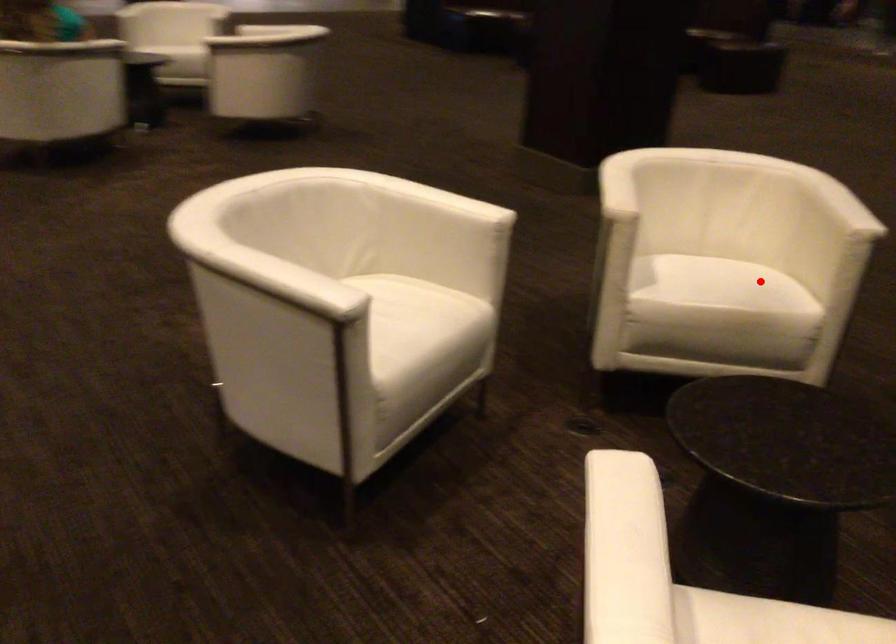
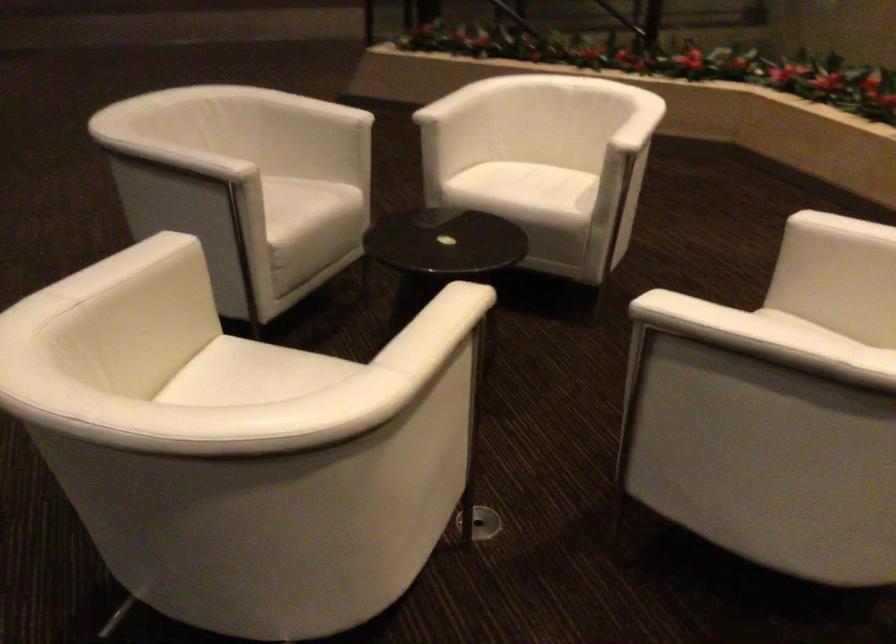
Question: A red point is marked in image1. In image2, is the corresponding 3D point closer to the camera or farther? Reply with the corresponding letter.

Choices:
 (A) The corresponding 3D point is closer.
 (B) The corresponding 3D point is farther.

Answer: (A)